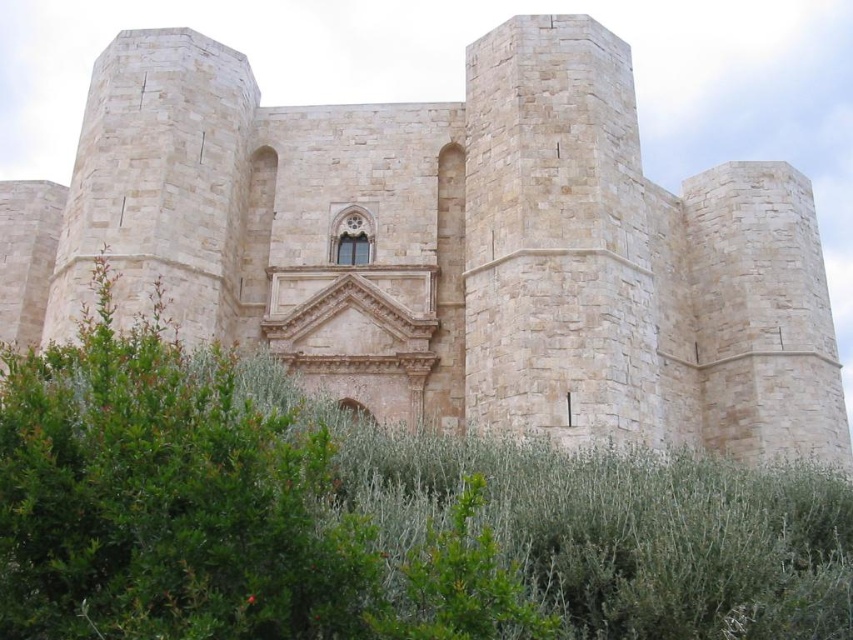
Can you confirm if beige stone castle at center is positioned to the right of green leafy bush at center?

Yes, beige stone castle at center is to the right of green leafy bush at center.

Does beige stone castle at center have a greater height compared to green leafy bush at center?

Indeed, beige stone castle at center has a greater height compared to green leafy bush at center.

Who is more forward, (651,189) or (32,518)?

Positioned in front is point (32,518).

This screenshot has height=640, width=853. In order to click on beige stone castle at center in this screenshot , I will do `click(445, 248)`.